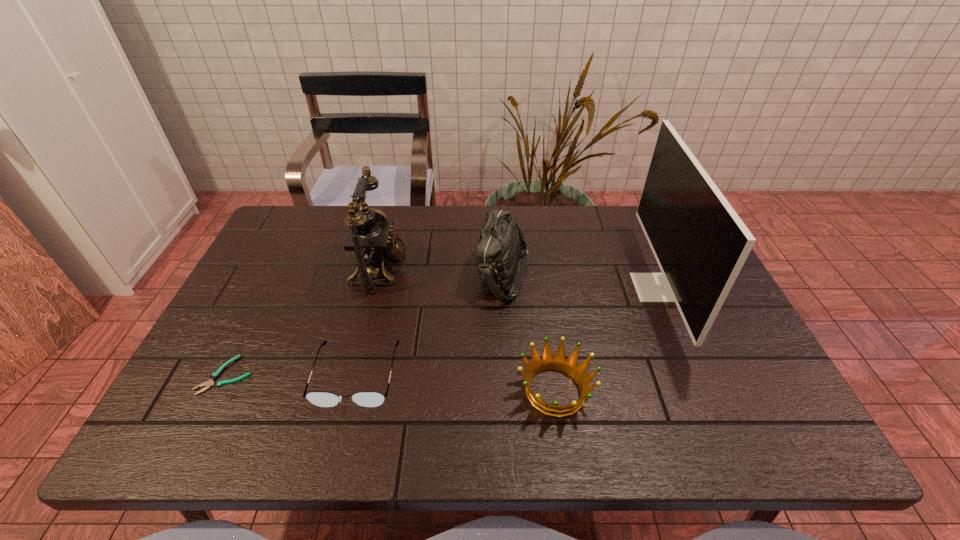
Identify which object is the third closest to the third shortest object. Please provide its 2D coordinates. Your answer should be formatted as a tuple, i.e. [(x, y)], where the tuple contains the x and y coordinates of a point satisfying the conditions above.

[(322, 399)]

Image resolution: width=960 pixels, height=540 pixels. Find the location of `free region that satisfies the following two spatial constraints: 1. on the rotary dial of the telephone; 2. on the left side of the crown`. free region that satisfies the following two spatial constraints: 1. on the rotary dial of the telephone; 2. on the left side of the crown is located at coordinates (349, 390).

You are a GUI agent. You are given a task and a screenshot of the screen. Output one action in this format:
    pyautogui.click(x=<x>, y=<y>)
    Task: Click on the blank area in the image that satisfies the following two spatial constraints: 1. on the front-facing side of the monitor; 2. on the lenses of the spectacles
    This screenshot has width=960, height=540.
    Given the screenshot: What is the action you would take?
    pyautogui.click(x=693, y=375)